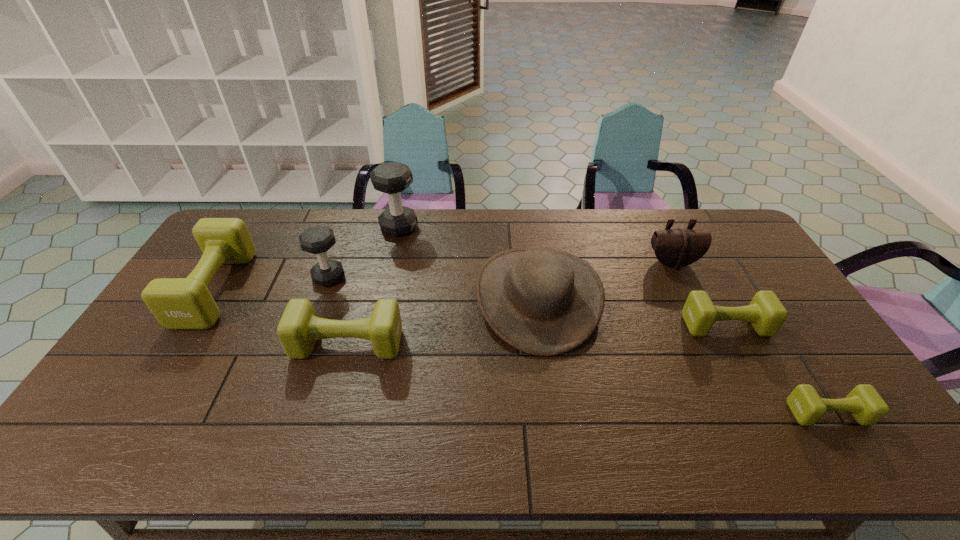
Select which object is the second closest to the brown cowboy hat. Please provide its 2D coordinates. Your answer should be formatted as a tuple, i.e. [(x, y)], where the tuple contains the x and y coordinates of a point satisfying the conditions above.

[(299, 328)]

At what (x,y) coordinates should I click in order to perform the action: click on the second closest dumbbell to the right gray dumbbell. Please return your answer as a coordinate pair (x, y). Image resolution: width=960 pixels, height=540 pixels. Looking at the image, I should click on (177, 303).

The width and height of the screenshot is (960, 540). I want to click on dumbbell that stands as the second closest to the left gray dumbbell, so click(392, 178).

Identify which olive dumbbell is the third nearest to the left gray dumbbell. Please provide its 2D coordinates. Your answer should be formatted as a tuple, i.e. [(x, y)], where the tuple contains the x and y coordinates of a point satisfying the conditions above.

[(766, 313)]

At what (x,y) coordinates should I click in order to perform the action: click on olive dumbbell that is the second closest one to the second shortest dumbbell. Please return your answer as a coordinate pair (x, y). Looking at the image, I should click on (299, 328).

The height and width of the screenshot is (540, 960). What are the coordinates of `vacant point that satisfies the following two spatial constraints: 1. on the front side of the fifth object from left to right; 2. on the right side of the second shortest dumbbell` in the screenshot? It's located at (541, 325).

Image resolution: width=960 pixels, height=540 pixels. In order to click on vacant region that satisfies the following two spatial constraints: 1. with the flap open on the pouch; 2. on the left side of the second smallest olive dumbbell in this screenshot , I will do `click(703, 325)`.

In order to click on blank area in the image that satisfies the following two spatial constraints: 1. on the front side of the second smallest olive dumbbell; 2. on the right side of the farther gray dumbbell in this screenshot , I will do `click(377, 325)`.